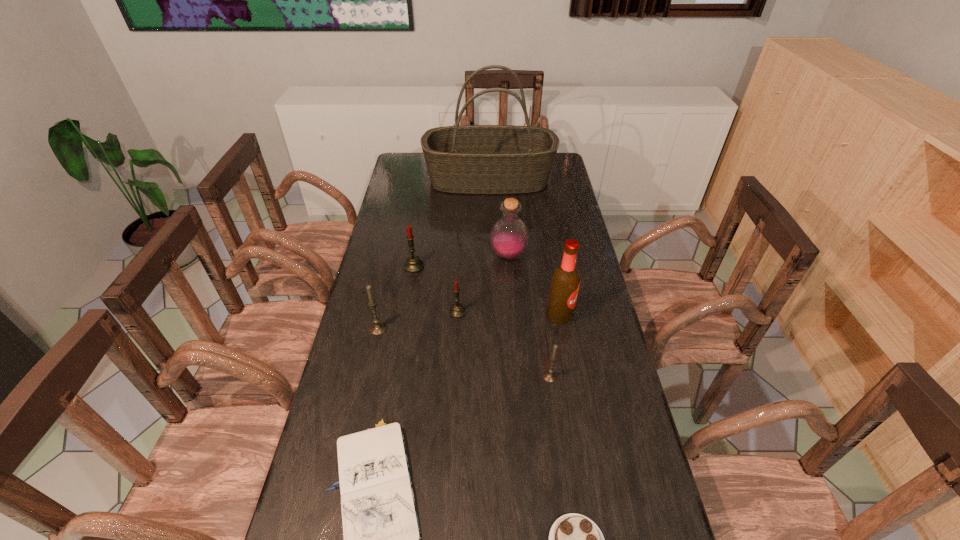
Find the location of a particular element. The height and width of the screenshot is (540, 960). object located at the far edge is located at coordinates (471, 159).

Identify the location of basket that is at the left edge. The image size is (960, 540). (471, 159).

Where is `basket that is at the right edge`? basket that is at the right edge is located at coordinates (471, 159).

Locate an element on the screen. beer bottle at the right edge is located at coordinates (564, 286).

Identify the location of object that is at the far left corner. (471, 159).

The height and width of the screenshot is (540, 960). In order to click on object at the far right corner in this screenshot , I will do `click(471, 159)`.

This screenshot has width=960, height=540. In order to click on free spot at the left edge of the desktop in this screenshot , I will do `click(366, 279)`.

In the image, there is a desktop. Where is `vacant area at the right edge`? vacant area at the right edge is located at coordinates (566, 385).

In the image, there is a desktop. What are the coordinates of `vacant space at the far left corner` in the screenshot? It's located at (416, 153).

Where is `free space at the far right corner of the desktop`? The height and width of the screenshot is (540, 960). free space at the far right corner of the desktop is located at coordinates (552, 168).